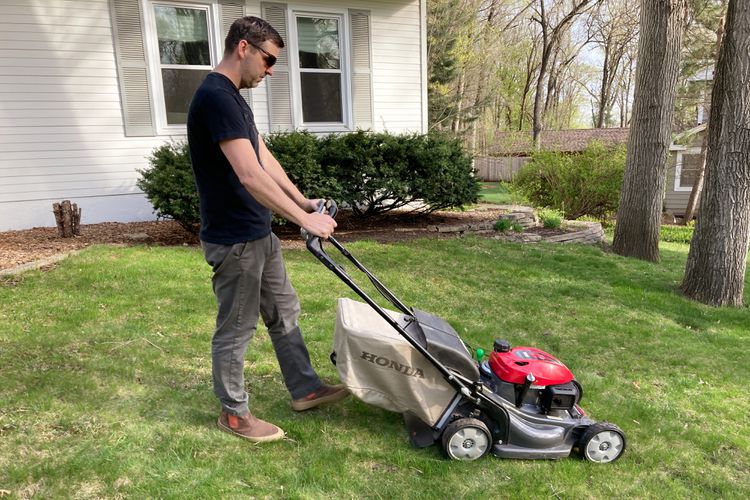
At what (x,y) coordinates should I click in order to perform the action: click on windows. Please return your answer as a coordinate pair (x, y). Looking at the image, I should click on point(319,58), point(183,50), point(687,173).